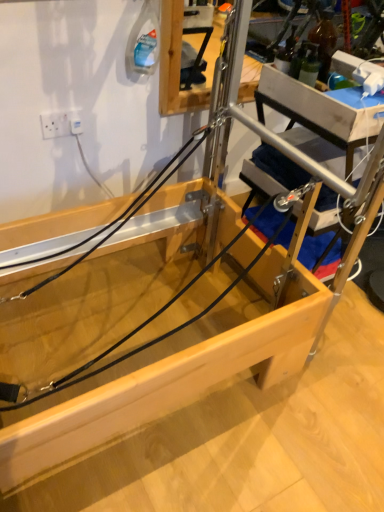
The width and height of the screenshot is (384, 512). Describe the element at coordinates (61, 124) in the screenshot. I see `white plastic electric outlet at upper left` at that location.

In the scene shown: In order to face white plastic electric outlet at upper left, should I rotate leftwards or rightwards?

Rotate left and turn 16.576 degrees.

Identify the location of white plastic electric outlet at upper left. This screenshot has width=384, height=512. (61, 124).

Locate an element on the screen. This screenshot has width=384, height=512. transparent plastic at center is located at coordinates (145, 324).

Describe the element at coordinates (145, 324) in the screenshot. I see `transparent plastic at center` at that location.

Where is `white plastic electric outlet at upper left`? The image size is (384, 512). white plastic electric outlet at upper left is located at coordinates (61, 124).

Is transparent plastic at center at the right side of white plastic electric outlet at upper left?

Indeed, transparent plastic at center is positioned on the right side of white plastic electric outlet at upper left.

Which object is more forward, transparent plastic at center or white plastic electric outlet at upper left?

Positioned in front is transparent plastic at center.

Does point (17, 385) lie in front of point (58, 120)?

Yes, it is.

From the image's perspective, is transparent plastic at center located above or below white plastic electric outlet at upper left?

Clearly, from the image's perspective, transparent plastic at center is below white plastic electric outlet at upper left.

From a real-world perspective, between transparent plastic at center and white plastic electric outlet at upper left, who is vertically higher?

white plastic electric outlet at upper left, from a real-world perspective.

Considering the relative sizes of transparent plastic at center and white plastic electric outlet at upper left in the image provided, is transparent plastic at center thinner than white plastic electric outlet at upper left?

No.

Does transparent plastic at center have a lesser height compared to white plastic electric outlet at upper left?

Correct, transparent plastic at center is not as tall as white plastic electric outlet at upper left.

Considering the relative sizes of transparent plastic at center and white plastic electric outlet at upper left in the image provided, is transparent plastic at center bigger than white plastic electric outlet at upper left?

Yes, transparent plastic at center is bigger than white plastic electric outlet at upper left.

In the scene shown: Does transparent plastic at center contain white plastic electric outlet at upper left?

Definitely not — white plastic electric outlet at upper left is not inside transparent plastic at center.

In the scene shown: Are transparent plastic at center and white plastic electric outlet at upper left making contact?

They are not placed beside each other.

Does transparent plastic at center turn towards white plastic electric outlet at upper left?

No, transparent plastic at center is not aimed at white plastic electric outlet at upper left.

Can you tell me how much transparent plastic at center and white plastic electric outlet at upper left differ in facing direction?

The angle between the facing direction of transparent plastic at center and the facing direction of white plastic electric outlet at upper left is 91.2 degrees.

Find the location of `string in front of the white plastic electric outlet at upper left`. string in front of the white plastic electric outlet at upper left is located at coordinates (145, 324).

Between white plastic electric outlet at upper left and transparent plastic at center, which one appears on the left side from the viewer's perspective?

white plastic electric outlet at upper left is more to the left.

Does white plastic electric outlet at upper left lie behind transparent plastic at center?

Yes, the depth of white plastic electric outlet at upper left is greater than that of transparent plastic at center.

Considering the positions of points (67, 134) and (198, 277), is point (67, 134) farther from camera compared to point (198, 277)?

Yes, it is.

From the image's perspective, relative to transparent plastic at center, is white plastic electric outlet at upper left above or below?

From the image's perspective, white plastic electric outlet at upper left appears above transparent plastic at center.

Looking at this image, from a real-world perspective, is white plastic electric outlet at upper left on transparent plastic at center?

Indeed, from a real-world perspective, white plastic electric outlet at upper left stands above transparent plastic at center.

Consider the image. Considering the sizes of objects white plastic electric outlet at upper left and transparent plastic at center in the image provided, who is thinner, white plastic electric outlet at upper left or transparent plastic at center?

white plastic electric outlet at upper left is thinner.

Is white plastic electric outlet at upper left shorter than transparent plastic at center?

Incorrect, the height of white plastic electric outlet at upper left does not fall short of that of transparent plastic at center.

Who is bigger, white plastic electric outlet at upper left or transparent plastic at center?

transparent plastic at center.

Choose the correct answer: Is white plastic electric outlet at upper left inside transparent plastic at center or outside it?

The correct answer is: outside.

Is white plastic electric outlet at upper left not near transparent plastic at center?

No, white plastic electric outlet at upper left is not far away from transparent plastic at center.

Is white plastic electric outlet at upper left oriented towards transparent plastic at center?

No, white plastic electric outlet at upper left is not facing towards transparent plastic at center.

What's the angular difference between white plastic electric outlet at upper left and transparent plastic at center's facing directions?

91.2 degrees.

At what (x,y) coordinates should I click in order to perform the action: click on electric outlet to the left of transparent plastic at center. Please return your answer as a coordinate pair (x, y). Looking at the image, I should click on (61, 124).

This screenshot has height=512, width=384. Identify the location of electric outlet above the transparent plastic at center (from a real-world perspective). (61, 124).

Identify the location of electric outlet lying behind the transparent plastic at center. The width and height of the screenshot is (384, 512). (61, 124).